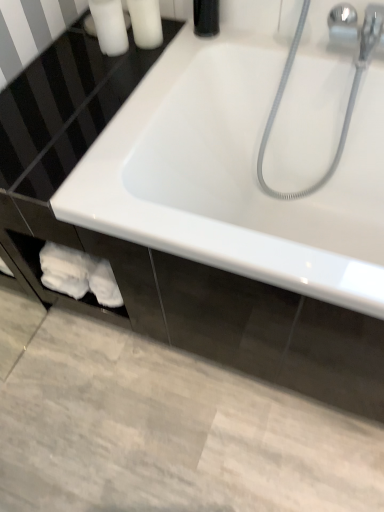
Question: From a real-world perspective, is white matte bottle at upper left, placed as the first toiletry when sorted from right to left, on white matte soap at upper left, arranged as the 2th toiletry when viewed from the right?

Choices:
 (A) yes
 (B) no

Answer: (A)

Question: From the image's perspective, is white matte bottle at upper left, arranged as the 2th toiletry when viewed from the left, located beneath white matte soap at upper left, which ranks as the first toiletry in left-to-right order?

Choices:
 (A) yes
 (B) no

Answer: (B)

Question: Can you confirm if white matte bottle at upper left, placed as the first toiletry when sorted from right to left, is smaller than white matte soap at upper left, arranged as the 2th toiletry when viewed from the right?

Choices:
 (A) yes
 (B) no

Answer: (B)

Question: Is white matte bottle at upper left, arranged as the 2th toiletry when viewed from the left, to the left of white matte soap at upper left, arranged as the 2th toiletry when viewed from the right, from the viewer's perspective?

Choices:
 (A) yes
 (B) no

Answer: (B)

Question: Are white matte bottle at upper left, arranged as the 2th toiletry when viewed from the left, and white matte soap at upper left, which ranks as the first toiletry in left-to-right order, located far from each other?

Choices:
 (A) yes
 (B) no

Answer: (B)

Question: Based on their sizes in the image, would you say white glossy bathtub at center is bigger or smaller than white matte soap at upper left, arranged as the 2th toiletry when viewed from the right?

Choices:
 (A) small
 (B) big

Answer: (B)

Question: Is point (195, 146) positioned closer to the camera than point (109, 10)?

Choices:
 (A) farther
 (B) closer

Answer: (A)

Question: Considering the positions of white glossy bathtub at center and white matte soap at upper left, which ranks as the first toiletry in left-to-right order, in the image, is white glossy bathtub at center taller or shorter than white matte soap at upper left, which ranks as the first toiletry in left-to-right order,?

Choices:
 (A) short
 (B) tall

Answer: (B)

Question: Considering the relative positions of white glossy bathtub at center and white matte soap at upper left, arranged as the 2th toiletry when viewed from the right, in the image provided, is white glossy bathtub at center to the left or to the right of white matte soap at upper left, arranged as the 2th toiletry when viewed from the right,?

Choices:
 (A) left
 (B) right

Answer: (B)

Question: Considering the positions of point (380, 275) and point (130, 13), is point (380, 275) closer or farther from the camera than point (130, 13)?

Choices:
 (A) farther
 (B) closer

Answer: (B)

Question: In terms of size, does white glossy bathtub at center appear bigger or smaller than white matte bottle at upper left, arranged as the 2th toiletry when viewed from the left?

Choices:
 (A) small
 (B) big

Answer: (B)

Question: From the image's perspective, is white glossy bathtub at center positioned above or below white matte bottle at upper left, arranged as the 2th toiletry when viewed from the left?

Choices:
 (A) below
 (B) above

Answer: (A)

Question: From their relative heights in the image, would you say white glossy bathtub at center is taller or shorter than white matte bottle at upper left, arranged as the 2th toiletry when viewed from the left?

Choices:
 (A) tall
 (B) short

Answer: (A)

Question: Is point (92, 9) positioned closer to the camera than point (155, 31)?

Choices:
 (A) farther
 (B) closer

Answer: (A)

Question: Looking at their shapes, would you say white matte soap at upper left, arranged as the 2th toiletry when viewed from the right, is wider or thinner than white matte bottle at upper left, placed as the first toiletry when sorted from right to left?

Choices:
 (A) wide
 (B) thin

Answer: (B)